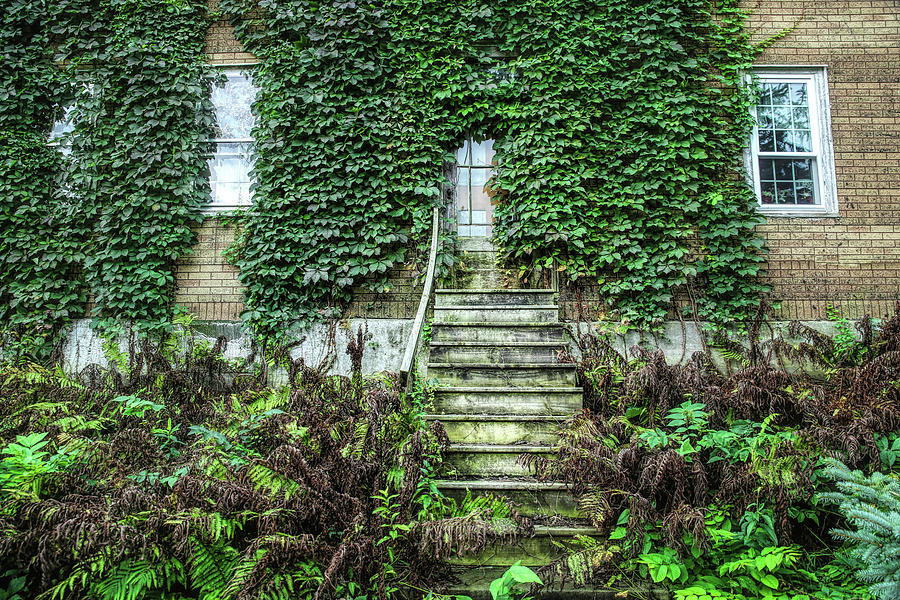
The height and width of the screenshot is (600, 900). Find the location of `door`. door is located at coordinates (489, 241).